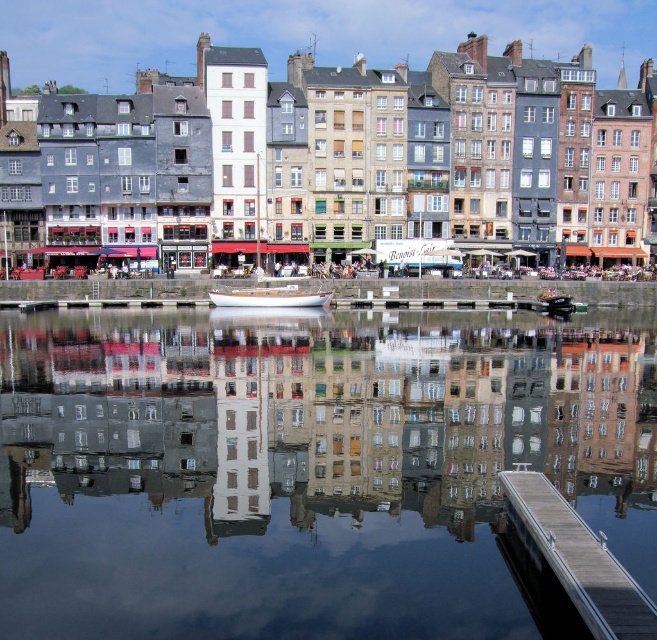
Question: Is smooth water at center above white wood boat at center?

Choices:
 (A) yes
 (B) no

Answer: (B)

Question: Among these objects, which one is nearest to the camera?

Choices:
 (A) white wooden boat at center
 (B) smooth water at center
 (C) wooden dock at lower right
 (D) white wood boat at center

Answer: (C)

Question: Does smooth water at center appear on the right side of wooden dock at lower right?

Choices:
 (A) yes
 (B) no

Answer: (B)

Question: Which point is closer to the camera?

Choices:
 (A) (535, 544)
 (B) (258, 294)
 (C) (430, 374)

Answer: (A)

Question: Estimate the real-world distances between objects in this image. Which object is farther from the smooth water at center?

Choices:
 (A) white wooden boat at center
 (B) white wood boat at center

Answer: (B)

Question: Does smooth water at center appear on the left side of white wooden boat at center?

Choices:
 (A) yes
 (B) no

Answer: (B)